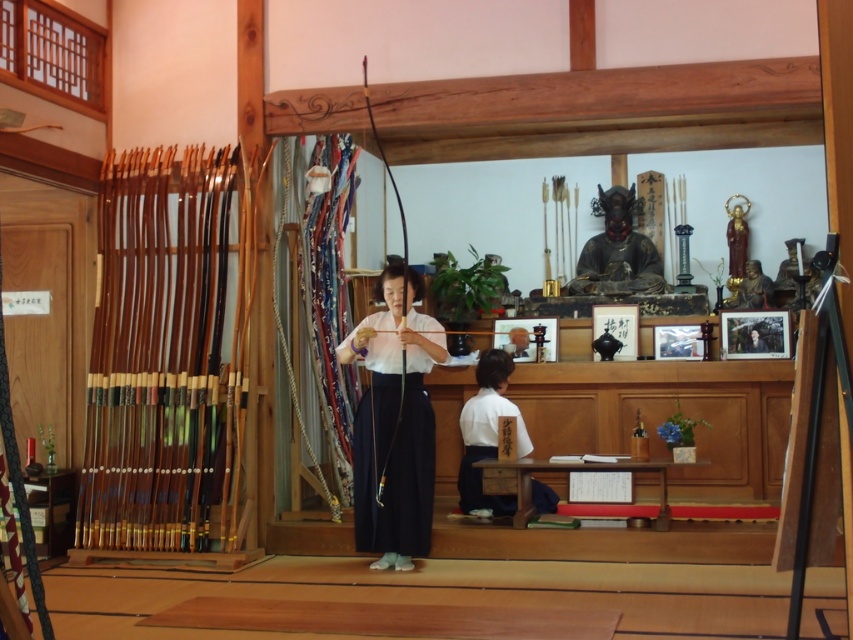
Is matte white shirt at center to the left of gold statue at upper right from the viewer's perspective?

Yes, matte white shirt at center is to the left of gold statue at upper right.

Does matte white shirt at center appear over gold statue at upper right?

No.

Does point (408, 384) lie in front of point (740, 225)?

Yes, it is in front of point (740, 225).

Where is `matte white shirt at center`? Image resolution: width=853 pixels, height=640 pixels. matte white shirt at center is located at coordinates (393, 424).

Which is behind, point (730, 198) or point (747, 285)?

Point (730, 198)

Is point (734, 252) closer to viewer compared to point (751, 300)?

No, it is behind (751, 300).

The width and height of the screenshot is (853, 640). Find the location of `gold statue at upper right`. gold statue at upper right is located at coordinates (735, 236).

Locate an element on the screen. This screenshot has height=640, width=853. gold statue at upper right is located at coordinates (735, 236).

Who is shorter, matte white shirt at center or matte gold statue at upper center?

matte gold statue at upper center

Who is taller, matte white shirt at center or matte gold statue at upper center?

matte white shirt at center

Measure the distance between point (392, 394) and camera.

They are 18.63 feet apart.

This screenshot has height=640, width=853. I want to click on matte white shirt at center, so click(x=393, y=424).